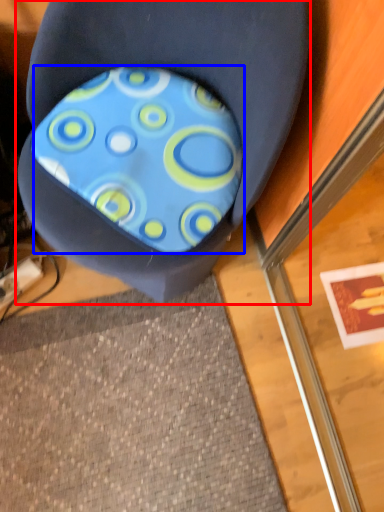
Question: Which of the following is the farthest to the observer, chair (highlighted by a red box) or design (highlighted by a blue box)?

Choices:
 (A) chair
 (B) design

Answer: (B)